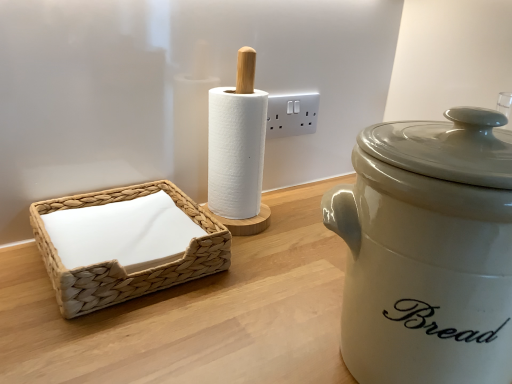
Question: Which direction should I rotate to look at white plastic electric outlet at upper center?

Choices:
 (A) right
 (B) left

Answer: (A)

Question: Is there a large distance between matte white ceramic bread bin at right and white plastic electric outlet at upper center?

Choices:
 (A) no
 (B) yes

Answer: (A)

Question: Considering the relative positions of matte white ceramic bread bin at right and white plastic electric outlet at upper center in the image provided, is matte white ceramic bread bin at right to the left of white plastic electric outlet at upper center from the viewer's perspective?

Choices:
 (A) yes
 (B) no

Answer: (B)

Question: Is matte white ceramic bread bin at right directly adjacent to white plastic electric outlet at upper center?

Choices:
 (A) yes
 (B) no

Answer: (B)

Question: Does matte white ceramic bread bin at right turn towards white plastic electric outlet at upper center?

Choices:
 (A) no
 (B) yes

Answer: (A)

Question: Is matte white ceramic bread bin at right positioned beyond the bounds of white plastic electric outlet at upper center?

Choices:
 (A) no
 (B) yes

Answer: (B)

Question: From a real-world perspective, is matte white ceramic bread bin at right positioned over white plastic electric outlet at upper center based on gravity?

Choices:
 (A) yes
 (B) no

Answer: (B)

Question: Is white plastic electric outlet at upper center oriented towards woven beige basket at left?

Choices:
 (A) no
 (B) yes

Answer: (A)

Question: Can you confirm if white plastic electric outlet at upper center is wider than woven beige basket at left?

Choices:
 (A) yes
 (B) no

Answer: (B)

Question: Can you confirm if white plastic electric outlet at upper center is positioned to the left of woven beige basket at left?

Choices:
 (A) yes
 (B) no

Answer: (B)

Question: From a real-world perspective, is white plastic electric outlet at upper center physically above woven beige basket at left?

Choices:
 (A) yes
 (B) no

Answer: (A)

Question: Does white plastic electric outlet at upper center have a greater height compared to woven beige basket at left?

Choices:
 (A) yes
 (B) no

Answer: (A)

Question: Is white plastic electric outlet at upper center bigger than woven beige basket at left?

Choices:
 (A) yes
 (B) no

Answer: (B)

Question: From a real-world perspective, is woven beige basket at left over white plastic electric outlet at upper center?

Choices:
 (A) no
 (B) yes

Answer: (A)